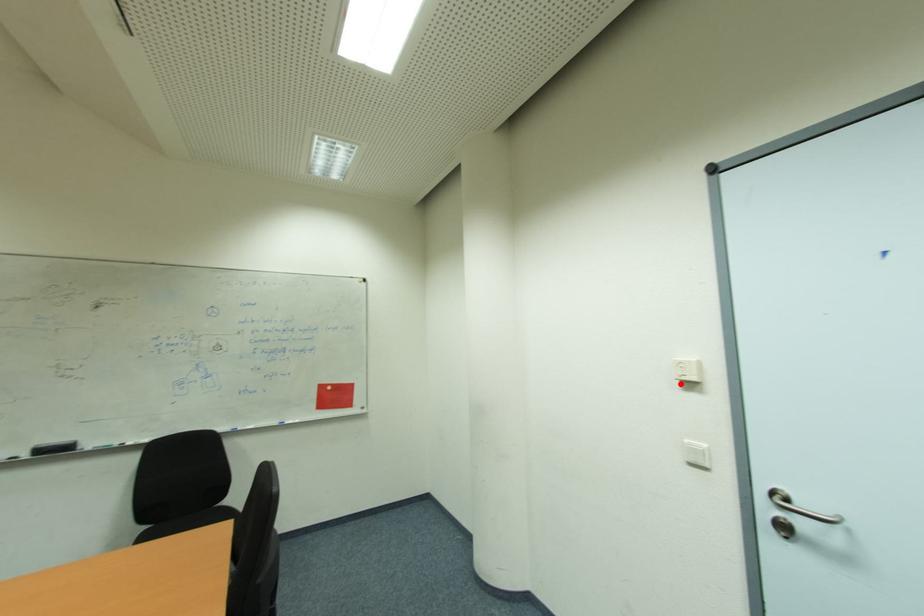
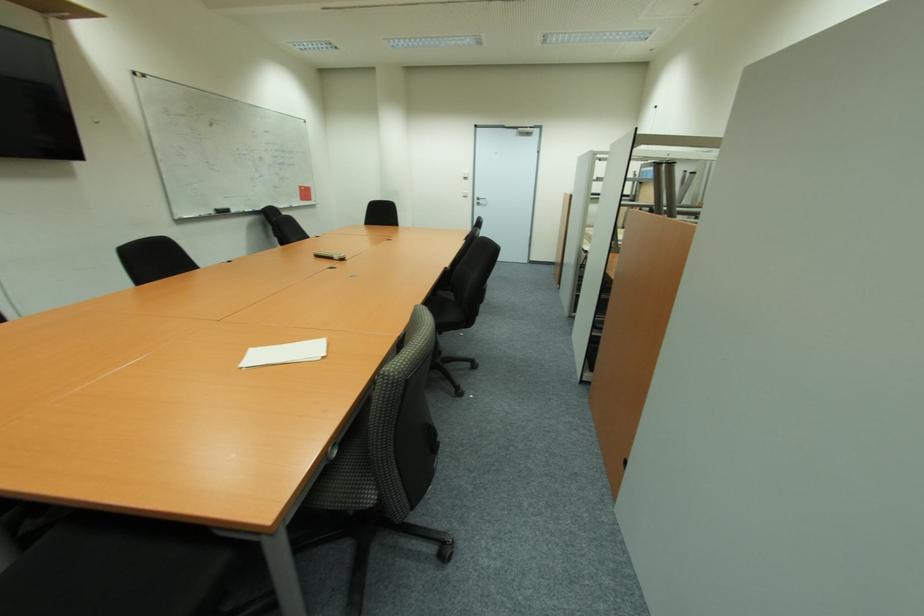
Question: A red point is marked in image1. In image2, is the corresponding 3D point closer to the camera or farther? Reply with the corresponding letter.

Choices:
 (A) The corresponding 3D point is closer.
 (B) The corresponding 3D point is farther.

Answer: (A)